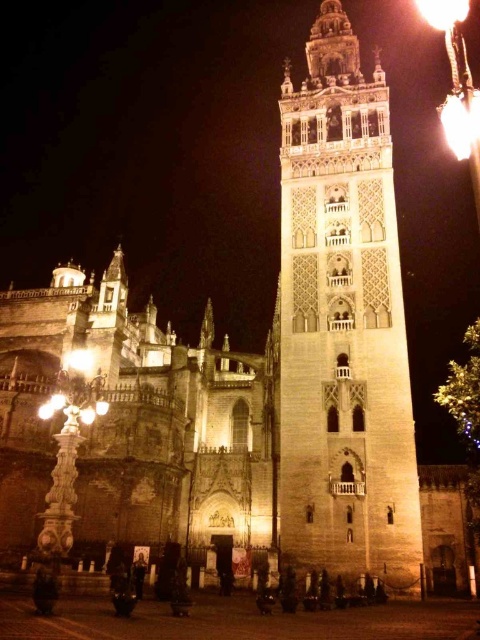
Question: Among these objects, which one is nearest to the camera?

Choices:
 (A) light beige stone bell tower at center
 (B) bright yellow flame at upper right

Answer: (B)

Question: Is light beige stone bell tower at center positioned at the back of bright yellow flame at upper right?

Choices:
 (A) yes
 (B) no

Answer: (A)

Question: Can you confirm if light beige stone bell tower at center is positioned to the right of bright yellow flame at upper right?

Choices:
 (A) no
 (B) yes

Answer: (A)

Question: Does light beige stone bell tower at center have a smaller size compared to bright yellow flame at upper right?

Choices:
 (A) no
 (B) yes

Answer: (B)

Question: Among these points, which one is nearest to the camera?

Choices:
 (A) (334, 259)
 (B) (444, 120)

Answer: (A)